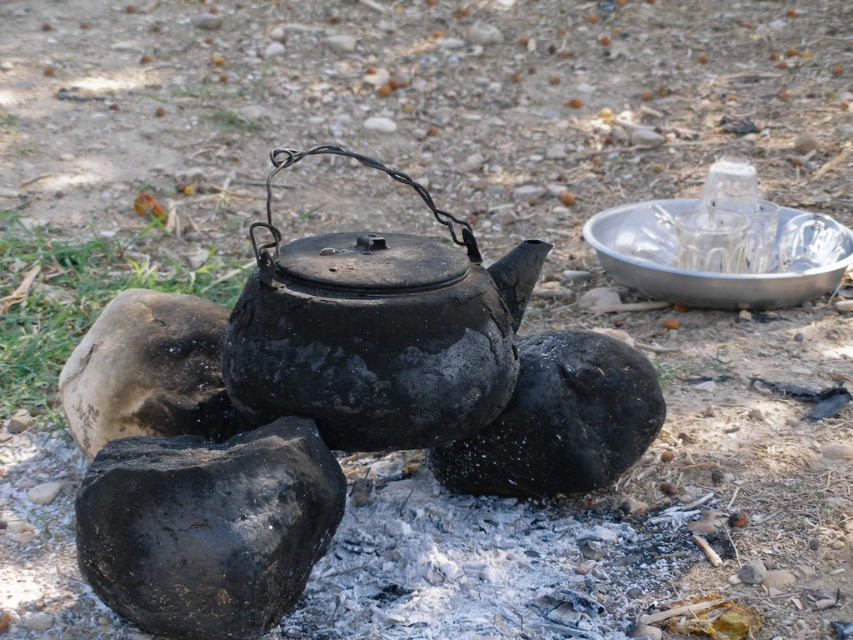
Question: Does black matte teapot at center have a lesser width compared to charcoal black rock at center?

Choices:
 (A) yes
 (B) no

Answer: (B)

Question: Observing the image, what is the correct spatial positioning of charcoal black rock at center in reference to brown rough rock at left?

Choices:
 (A) right
 (B) left

Answer: (A)

Question: Which of these objects is positioned farthest from the brown rough rock at left?

Choices:
 (A) charcoal black rock at lower left
 (B) black matte teapot at center
 (C) charcoal black rock at center

Answer: (C)

Question: Based on their relative distances, which object is farther from the brown rough rock at left?

Choices:
 (A) black matte teapot at center
 (B) charcoal black rock at center
 (C) charcoal black rock at lower left

Answer: (B)

Question: Can you confirm if charcoal black rock at lower left is bigger than brown rough rock at left?

Choices:
 (A) yes
 (B) no

Answer: (B)

Question: Which point is farther to the camera?

Choices:
 (A) (91, 348)
 (B) (337, 340)

Answer: (A)